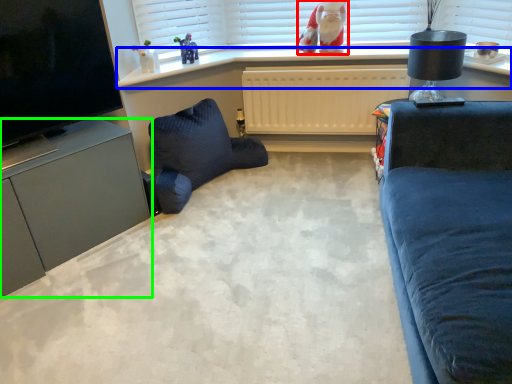
Question: Which object is positioned farthest from doll (highlighted by a red box)? Select from window sill (highlighted by a blue box) and cabinetry (highlighted by a green box).

Choices:
 (A) window sill
 (B) cabinetry

Answer: (B)